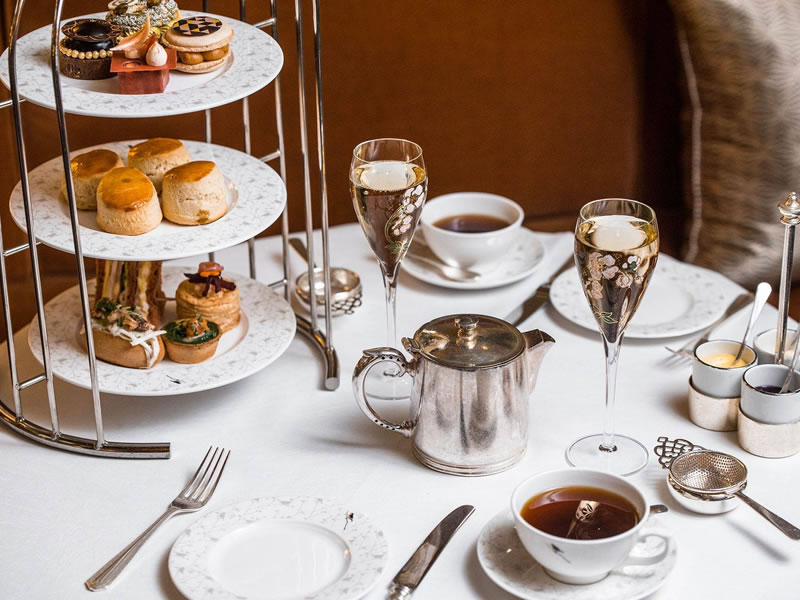
At what (x,y) coordinates should I click in order to perform the action: click on fork. Please return your answer as a coordinate pair (x, y). This screenshot has height=600, width=800. Looking at the image, I should click on (202, 479).